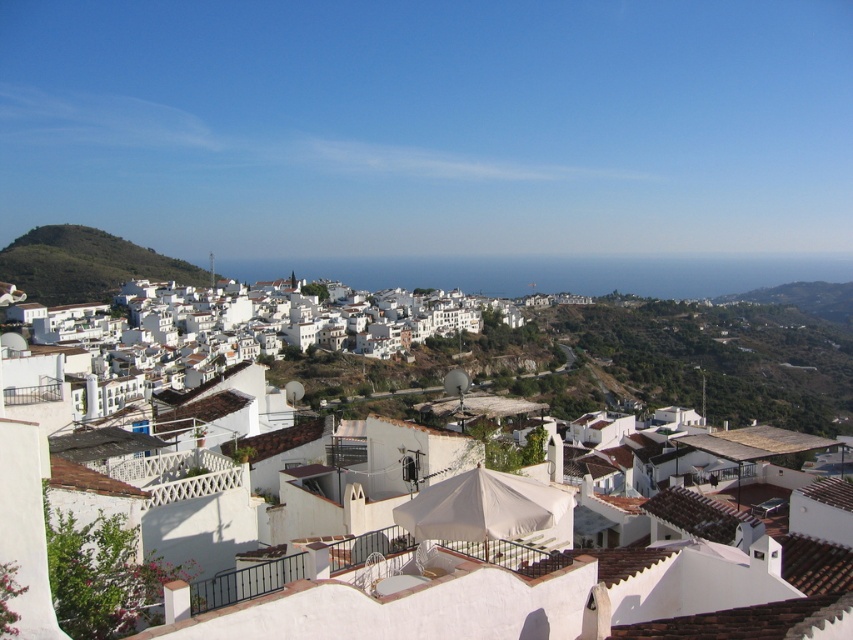
Between point (775, 584) and point (125, 301), which one is positioned in front?

Point (775, 584) is more forward.

Describe the element at coordinates (550, 600) in the screenshot. I see `white matte roof at center` at that location.

Between point (636, 550) and point (228, 362), which one is positioned in front?

Point (636, 550)

You are a GUI agent. You are given a task and a screenshot of the screen. Output one action in this format:
    pyautogui.click(x=<x>, y=<y>)
    Task: Click on the white matte roof at center
    The width and height of the screenshot is (853, 640).
    Given the screenshot: What is the action you would take?
    pyautogui.click(x=550, y=600)